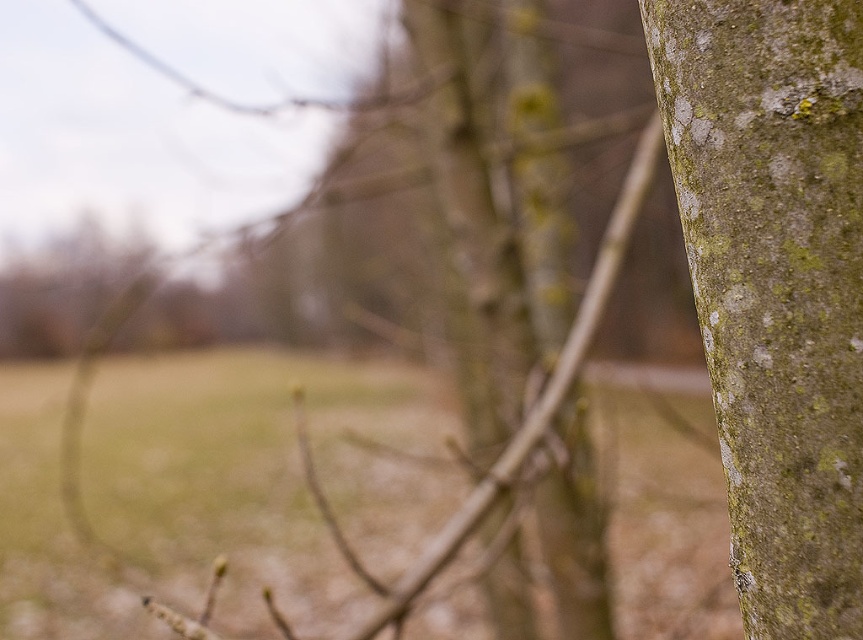
Question: Which point is closer to the camera?

Choices:
 (A) green mossy bark at upper right
 (B) green mossy bark at right

Answer: (B)

Question: Which object appears farthest from the camera in this image?

Choices:
 (A) green mossy bark at upper right
 (B) green mossy bark at right

Answer: (A)

Question: Can you confirm if green mossy bark at right is positioned above green mossy bark at upper right?

Choices:
 (A) yes
 (B) no

Answer: (B)

Question: Can you confirm if green mossy bark at right is bigger than green mossy bark at upper right?

Choices:
 (A) no
 (B) yes

Answer: (A)

Question: Observing the image, what is the correct spatial positioning of green mossy bark at right in reference to green mossy bark at upper right?

Choices:
 (A) above
 (B) below

Answer: (B)